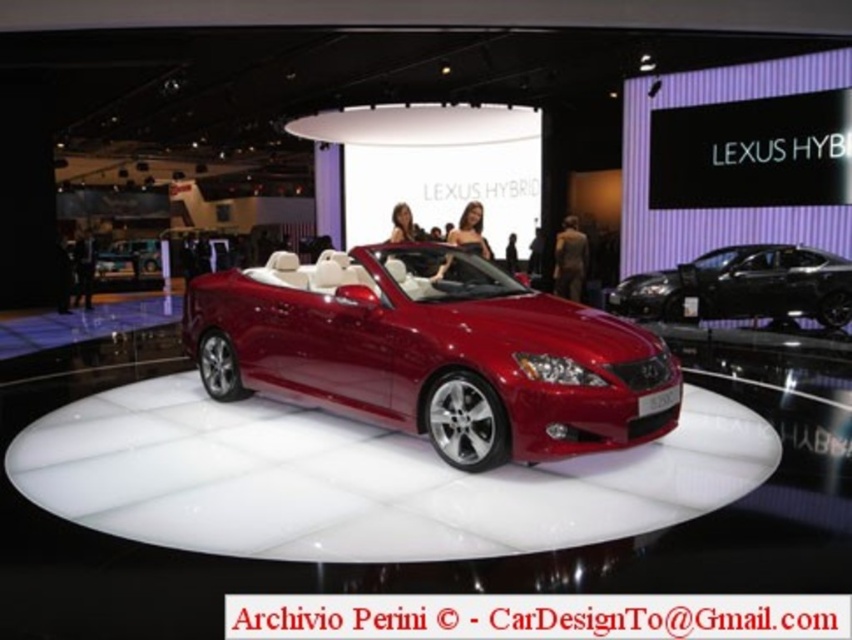
You are a photographer at the auto show and want to capture a photo of both the shiny red convertible at center and the metallic silver car at center in the same frame. Which car should you focus on first to ensure both are in the frame without moving the camera?

The shiny red convertible at center is taller than the metallic silver car at center. To include both in the frame, focus on the shiny red convertible at center first as it requires more vertical space.